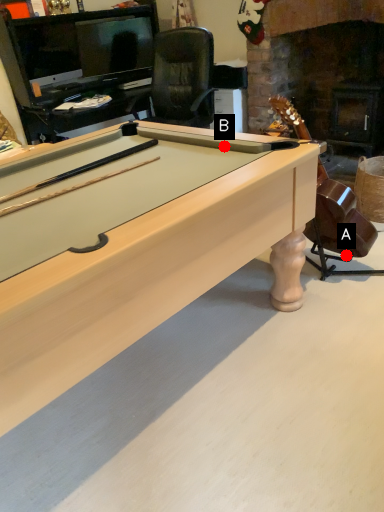
Question: Two points are circled on the image, labeled by A and B beside each circle. Which point is closer to the camera?

Choices:
 (A) A is closer
 (B) B is closer

Answer: (B)